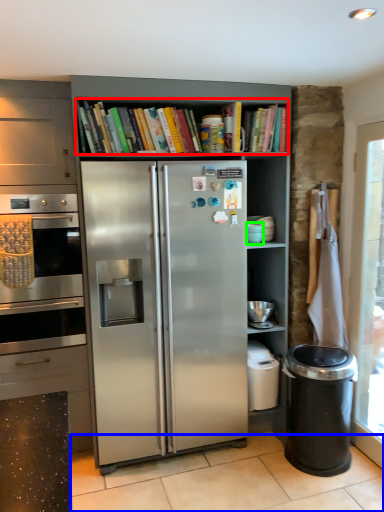
Question: Which object is positioned farthest from shelf (highlighted by a red box)? Select from tile (highlighted by a blue box) and appliance (highlighted by a green box).

Choices:
 (A) tile
 (B) appliance

Answer: (A)